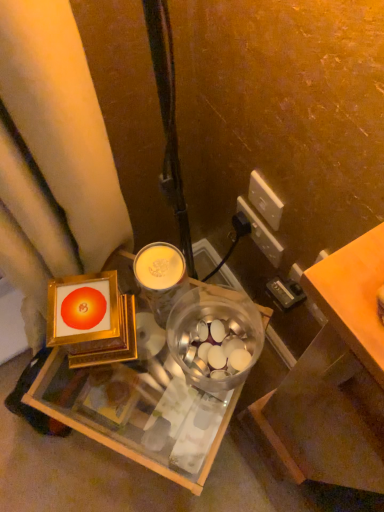
Question: Considering the relative sizes of white plastic power outlet at upper right, the first power outlet positioned from the back, and metallic gold frame at center in the image provided, is white plastic power outlet at upper right, the first power outlet positioned from the back, shorter than metallic gold frame at center?

Choices:
 (A) yes
 (B) no

Answer: (A)

Question: Is the depth of white plastic power outlet at upper right, the first power outlet positioned from the back, greater than that of metallic gold frame at center?

Choices:
 (A) yes
 (B) no

Answer: (A)

Question: Can you confirm if white plastic power outlet at upper right, the first power outlet positioned from the back, is taller than metallic gold frame at center?

Choices:
 (A) no
 (B) yes

Answer: (A)

Question: Is white plastic power outlet at upper right, acting as the 2th power outlet starting from the front, closer to camera compared to metallic gold frame at center?

Choices:
 (A) no
 (B) yes

Answer: (A)

Question: From a real-world perspective, is white plastic power outlet at upper right, acting as the 2th power outlet starting from the front, located beneath metallic gold frame at center?

Choices:
 (A) no
 (B) yes

Answer: (A)

Question: Is metallic gold frame at center wider or thinner than white plastic power outlet at upper right, acting as the 2th power outlet starting from the front?

Choices:
 (A) wide
 (B) thin

Answer: (A)

Question: From their relative heights in the image, would you say metallic gold frame at center is taller or shorter than white plastic power outlet at upper right, acting as the 2th power outlet starting from the front?

Choices:
 (A) tall
 (B) short

Answer: (A)

Question: Relative to white plastic power outlet at upper right, acting as the 2th power outlet starting from the front, is metallic gold frame at center in front or behind?

Choices:
 (A) front
 (B) behind

Answer: (A)

Question: From the image's perspective, relative to white plastic power outlet at upper right, acting as the 2th power outlet starting from the front, is metallic gold frame at center above or below?

Choices:
 (A) above
 (B) below

Answer: (B)

Question: Would you say white plastic power outlet at upper right, the first power outlet positioned from the back, is to the left or to the right of orange matte table at right in the picture?

Choices:
 (A) right
 (B) left

Answer: (A)

Question: Considering the positions of white plastic power outlet at upper right, the first power outlet positioned from the back, and orange matte table at right in the image, is white plastic power outlet at upper right, the first power outlet positioned from the back, wider or thinner than orange matte table at right?

Choices:
 (A) thin
 (B) wide

Answer: (A)

Question: Considering the positions of white plastic power outlet at upper right, acting as the 2th power outlet starting from the front, and orange matte table at right in the image, is white plastic power outlet at upper right, acting as the 2th power outlet starting from the front, taller or shorter than orange matte table at right?

Choices:
 (A) tall
 (B) short

Answer: (A)

Question: Is white plastic power outlet at upper right, acting as the 2th power outlet starting from the front, inside or outside of orange matte table at right?

Choices:
 (A) outside
 (B) inside

Answer: (A)

Question: From a real-world perspective, is white plastic power outlet at upper right, acting as the 2th power outlet starting from the front, above or below metallic gold frame at center?

Choices:
 (A) above
 (B) below

Answer: (A)

Question: Is white plastic power outlet at upper right, acting as the 2th power outlet starting from the front, to the left or to the right of metallic gold frame at center in the image?

Choices:
 (A) left
 (B) right

Answer: (B)